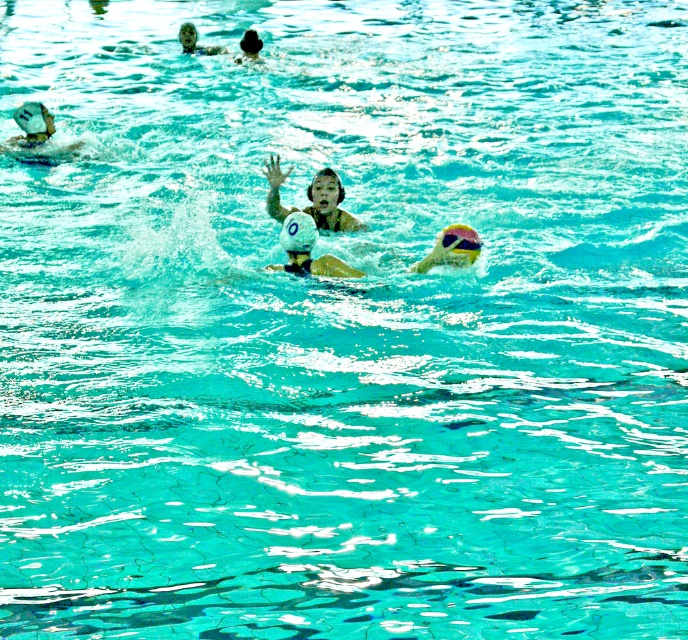
Based on the photo, you are a water polo referee observing the game. The ball must be within the playing area defined by the pool edges. Given the ball is at point (x=451, y=248), can you confirm if the ball is inside the pool?

The yellow rubber ball at center is located at point (x=451, y=248), which is within the pool area since the pool edges are the boundaries of the image shown.

You are a photographer standing at the poolside. You want to take a photo of the smooth white swimmer at center and the white matte swim cap at upper left. Which object should you focus on first if you want to capture both in a single frame without zooming?

The smooth white swimmer at center is wider than the white matte swim cap at upper left, so focusing on the smooth white swimmer at center first would ensure it fits in the frame while still capturing the smaller white matte swim cap at upper left.

You are a water polo referee observing the game. You notice the white matte swim cap at upper left and the yellow rubber ball at center. Which object is bigger in size?

The white matte swim cap at upper left has a larger size compared to the yellow rubber ball at center.